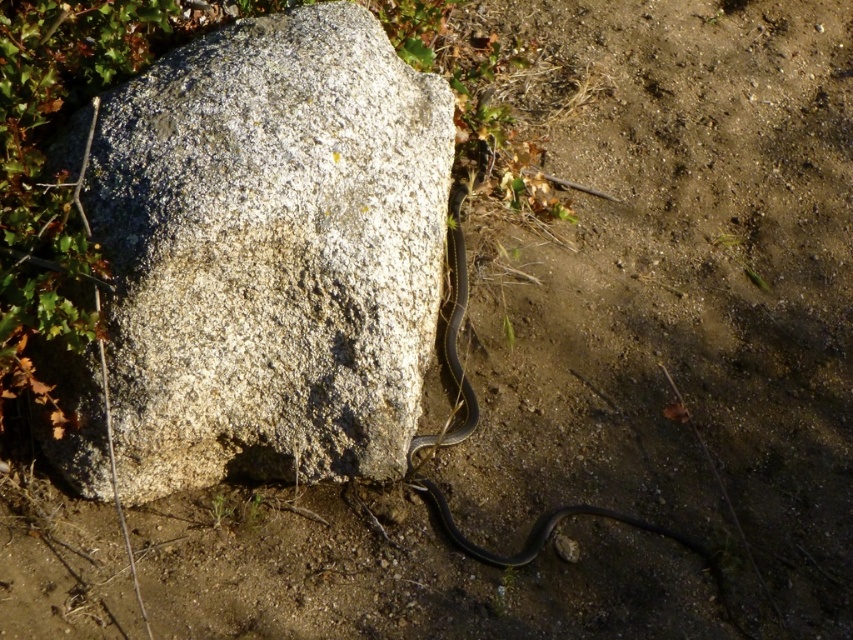
Which of these two, granite rock at center or black glossy snake at center, stands shorter?

Standing shorter between the two is black glossy snake at center.

Is granite rock at center further to the viewer compared to black glossy snake at center?

No, granite rock at center is closer to the viewer.

Describe the element at coordinates (271, 252) in the screenshot. I see `granite rock at center` at that location.

I want to click on granite rock at center, so click(271, 252).